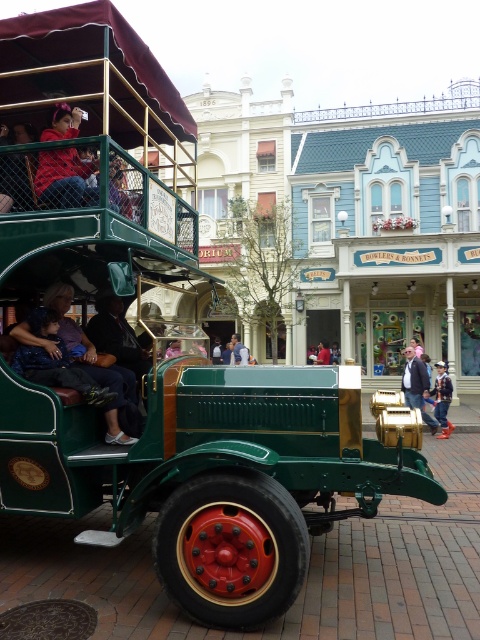
You are a photographer standing on the brick street wanting to take a photo of the passengers in the vintage vehicle. You want to ensure both the matte green jacket at left and the red shirt at center are in the frame. Based on their positions, which passenger should you focus on first to include both in the shot?

The matte green jacket at left is positioned on the left side of red shirt at center, so focusing on the red shirt at center first will naturally include the matte green jacket at left in the frame as it is to the left of the red shirt at center.

You are a photographer standing on the brick street at the themed park. You want to take a photo that includes both the matte red jacket at upper left and the red shirt at center. Which object should you position to your left to ensure both are in the frame?

The matte red jacket at upper left should be positioned to your left since it is already to the left of the red shirt at center, ensuring both are included in the photo.

In the scene shown: You are a photographer standing on the brick street and want to take a photo of the matte green jacket at left and the red shirt at center. Which one is positioned higher in the frame?

The matte green jacket at left is above the red shirt at center, so it is positioned higher in the frame.